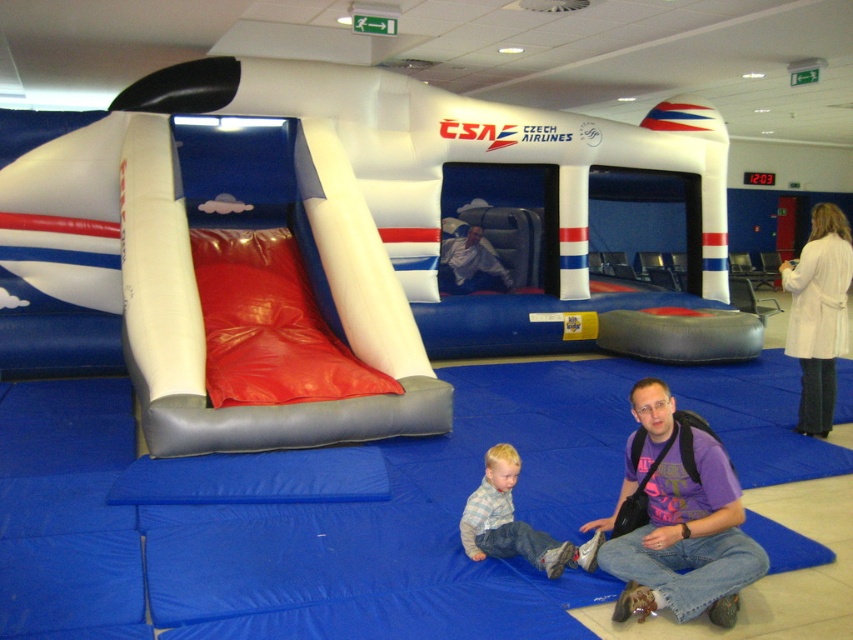
You are a photographer trying to capture a photo of the white wool coat at upper right and the light blue denim jeans at lower center. To ensure both are in frame, where should you position yourself relative to the objects?

You should position yourself below the white wool coat at upper right and above the light blue denim jeans at lower center so that both are visible in the frame since the white wool coat at upper right is above the light blue denim jeans at lower center.

You are a photographer trying to capture a photo of the white wool coat at upper right and the light blue denim jeans at lower center. Since you want both subjects to appear balanced in the frame, which object should you position closer to the camera?

→ The white wool coat at upper right is much taller than the light blue denim jeans at lower center, so you should position the white wool coat at upper right farther away from the camera to balance their sizes in the photo.